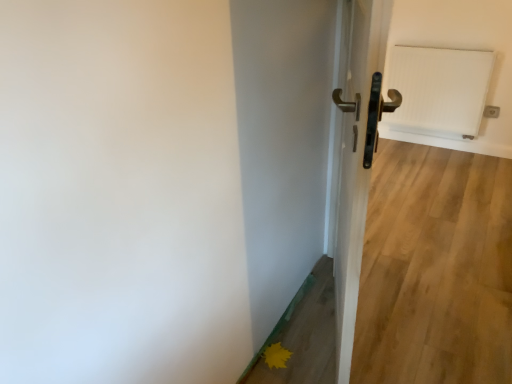
Question: From a real-world perspective, is metallic gold door handle at center beneath white textured radiator at upper right?

Choices:
 (A) no
 (B) yes

Answer: (A)

Question: Is metallic gold door handle at center positioned beyond the bounds of white textured radiator at upper right?

Choices:
 (A) no
 (B) yes

Answer: (B)

Question: Can you confirm if metallic gold door handle at center is wider than white textured radiator at upper right?

Choices:
 (A) no
 (B) yes

Answer: (B)

Question: Is metallic gold door handle at center far from white textured radiator at upper right?

Choices:
 (A) yes
 (B) no

Answer: (A)

Question: Is metallic gold door handle at center bigger than white textured radiator at upper right?

Choices:
 (A) yes
 (B) no

Answer: (A)

Question: Relative to yellow matte flower at lower right, is metallic gold door handle at center in front or behind?

Choices:
 (A) front
 (B) behind

Answer: (A)

Question: From a real-world perspective, is metallic gold door handle at center above or below yellow matte flower at lower right?

Choices:
 (A) below
 (B) above

Answer: (B)

Question: From their relative heights in the image, would you say metallic gold door handle at center is taller or shorter than yellow matte flower at lower right?

Choices:
 (A) tall
 (B) short

Answer: (A)

Question: Would you say metallic gold door handle at center is inside or outside yellow matte flower at lower right?

Choices:
 (A) outside
 (B) inside

Answer: (A)

Question: From their relative heights in the image, would you say metallic gold door handle at center is taller or shorter than white textured radiator at upper right?

Choices:
 (A) short
 (B) tall

Answer: (B)

Question: From the image's perspective, is metallic gold door handle at center positioned above or below white textured radiator at upper right?

Choices:
 (A) above
 (B) below

Answer: (B)

Question: Does point (338, 331) appear closer or farther from the camera than point (394, 84)?

Choices:
 (A) farther
 (B) closer

Answer: (B)

Question: Considering the relative positions of metallic gold door handle at center and white textured radiator at upper right in the image provided, is metallic gold door handle at center to the left or to the right of white textured radiator at upper right?

Choices:
 (A) left
 (B) right

Answer: (A)

Question: Is white textured radiator at upper right inside the boundaries of metallic gold door handle at center, or outside?

Choices:
 (A) outside
 (B) inside

Answer: (A)

Question: From their relative heights in the image, would you say white textured radiator at upper right is taller or shorter than metallic gold door handle at center?

Choices:
 (A) tall
 (B) short

Answer: (B)